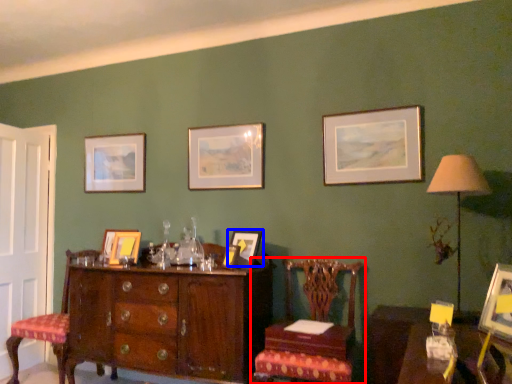
Question: Which object is further to the camera taking this photo, chair (highlighted by a red box) or picture frame (highlighted by a blue box)?

Choices:
 (A) chair
 (B) picture frame

Answer: (B)